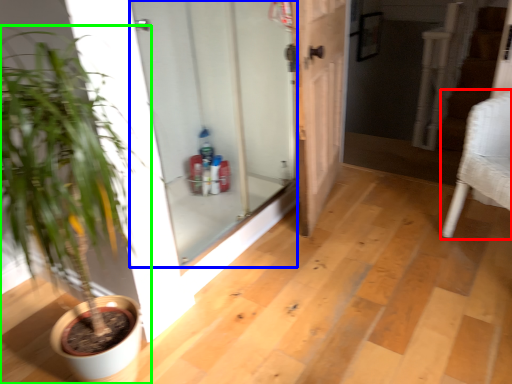
Question: Based on their relative distances, which object is nearer to armchair (highlighted by a red box)? Choose from door (highlighted by a blue box) and houseplant (highlighted by a green box).

Choices:
 (A) door
 (B) houseplant

Answer: (A)